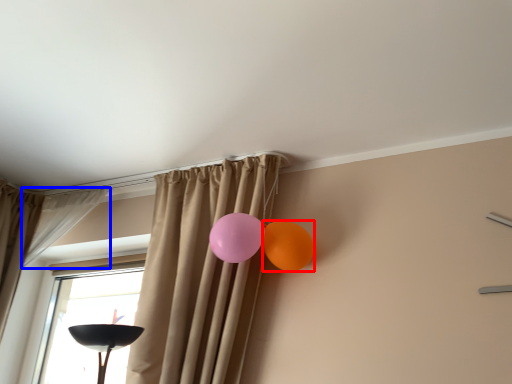
Question: Which of the following is the closest to the observer, balloon (highlighted by a red box) or curtain (highlighted by a blue box)?

Choices:
 (A) balloon
 (B) curtain

Answer: (A)